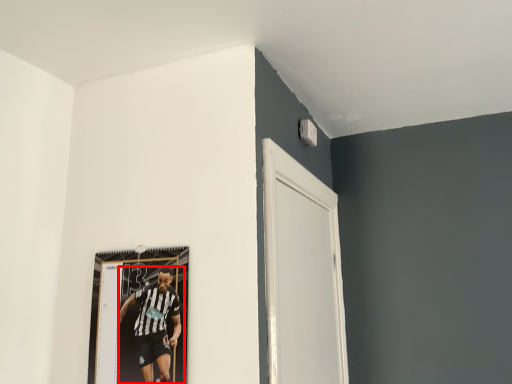
Question: From the image's perspective, where is person (annotated by the red box) located in relation to door in the image?

Choices:
 (A) below
 (B) above

Answer: (A)